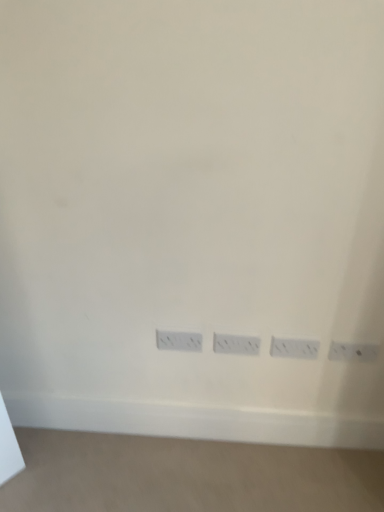
This screenshot has height=512, width=384. What do you see at coordinates (236, 344) in the screenshot?
I see `white plastic power plugs and sockets at center, the second power plugs and sockets when ordered from left to right` at bounding box center [236, 344].

Identify the location of white plastic power plugs and sockets at center, positioned as the third power plugs and sockets in right-to-left order. This screenshot has height=512, width=384. click(x=236, y=344).

The height and width of the screenshot is (512, 384). What are the coordinates of `white plastic power plugs and sockets at center, positioned as the 3th power plugs and sockets in left-to-right order` in the screenshot? It's located at (294, 348).

This screenshot has width=384, height=512. What are the coordinates of `white plastic power plugs and sockets at lower right, the 1th power plugs and sockets from the right` in the screenshot? It's located at (353, 352).

The image size is (384, 512). What do you see at coordinates (353, 352) in the screenshot?
I see `white plastic power plugs and sockets at lower right, placed as the 4th power plugs and sockets when sorted from left to right` at bounding box center [353, 352].

The width and height of the screenshot is (384, 512). What do you see at coordinates (179, 341) in the screenshot? I see `white plastic power plugs and sockets at lower center, which appears as the first power plugs and sockets when viewed from the left` at bounding box center [179, 341].

I want to click on white plastic power plugs and sockets at center, positioned as the third power plugs and sockets in right-to-left order, so click(236, 344).

From the image's perspective, is white plastic power plugs and sockets at lower right, the 1th power plugs and sockets from the right, located above white plastic power plugs and sockets at lower center, which is counted as the 4th power plugs and sockets, starting from the right?

No, from the image's perspective, white plastic power plugs and sockets at lower right, the 1th power plugs and sockets from the right, is not above white plastic power plugs and sockets at lower center, which is counted as the 4th power plugs and sockets, starting from the right.

Is white plastic power plugs and sockets at lower right, placed as the 4th power plugs and sockets when sorted from left to right, oriented away from white plastic power plugs and sockets at lower center, which appears as the first power plugs and sockets when viewed from the left?

white plastic power plugs and sockets at lower right, placed as the 4th power plugs and sockets when sorted from left to right, is not turned away from white plastic power plugs and sockets at lower center, which appears as the first power plugs and sockets when viewed from the left.

In the scene shown: Which object is closer to the camera taking this photo, white plastic power plugs and sockets at lower right, placed as the 4th power plugs and sockets when sorted from left to right, or white plastic power plugs and sockets at lower center, which appears as the first power plugs and sockets when viewed from the left?

white plastic power plugs and sockets at lower right, placed as the 4th power plugs and sockets when sorted from left to right.

Is white plastic power plugs and sockets at lower right, the 1th power plugs and sockets from the right, bigger or smaller than white plastic power plugs and sockets at lower center, which is counted as the 4th power plugs and sockets, starting from the right?

Clearly, white plastic power plugs and sockets at lower right, the 1th power plugs and sockets from the right, is smaller in size than white plastic power plugs and sockets at lower center, which is counted as the 4th power plugs and sockets, starting from the right.

Between point (361, 347) and point (294, 344), which one is positioned behind?

The point (294, 344) is more distant.

Does white plastic power plugs and sockets at lower right, the 1th power plugs and sockets from the right, touch white plastic power plugs and sockets at center, positioned as the 3th power plugs and sockets in left-to-right order?

There is a gap between white plastic power plugs and sockets at lower right, the 1th power plugs and sockets from the right, and white plastic power plugs and sockets at center, positioned as the 3th power plugs and sockets in left-to-right order.

From the image's perspective, is white plastic power plugs and sockets at lower right, placed as the 4th power plugs and sockets when sorted from left to right, on top of white plastic power plugs and sockets at center, positioned as the 3th power plugs and sockets in left-to-right order?

No, from the image's perspective, white plastic power plugs and sockets at lower right, placed as the 4th power plugs and sockets when sorted from left to right, is not on top of white plastic power plugs and sockets at center, positioned as the 3th power plugs and sockets in left-to-right order.

From a real-world perspective, is white plastic power plugs and sockets at lower right, placed as the 4th power plugs and sockets when sorted from left to right, on white plastic power plugs and sockets at center, which is the second power plugs and sockets from right to left?

Correct, in the physical world, white plastic power plugs and sockets at lower right, placed as the 4th power plugs and sockets when sorted from left to right, is higher than white plastic power plugs and sockets at center, which is the second power plugs and sockets from right to left.

Does white plastic power plugs and sockets at lower center, which is counted as the 4th power plugs and sockets, starting from the right, have a greater width compared to white plastic power plugs and sockets at center, the second power plugs and sockets when ordered from left to right?

Indeed, white plastic power plugs and sockets at lower center, which is counted as the 4th power plugs and sockets, starting from the right, has a greater width compared to white plastic power plugs and sockets at center, the second power plugs and sockets when ordered from left to right.

Where is `power plugs and sockets that is above the white plastic power plugs and sockets at center, the second power plugs and sockets when ordered from left to right (from the image's perspective)`? This screenshot has height=512, width=384. power plugs and sockets that is above the white plastic power plugs and sockets at center, the second power plugs and sockets when ordered from left to right (from the image's perspective) is located at coordinates (179, 341).

From the image's perspective, between white plastic power plugs and sockets at lower center, which appears as the first power plugs and sockets when viewed from the left, and white plastic power plugs and sockets at center, positioned as the third power plugs and sockets in right-to-left order, who is located below?

white plastic power plugs and sockets at center, positioned as the third power plugs and sockets in right-to-left order, is shown below in the image.

Which is correct: white plastic power plugs and sockets at lower center, which is counted as the 4th power plugs and sockets, starting from the right, is inside white plastic power plugs and sockets at center, the second power plugs and sockets when ordered from left to right, or outside of it?

white plastic power plugs and sockets at lower center, which is counted as the 4th power plugs and sockets, starting from the right, is located beyond the bounds of white plastic power plugs and sockets at center, the second power plugs and sockets when ordered from left to right.

Which object is wider, white plastic power plugs and sockets at center, positioned as the 3th power plugs and sockets in left-to-right order, or white plastic power plugs and sockets at lower center, which appears as the first power plugs and sockets when viewed from the left?

white plastic power plugs and sockets at lower center, which appears as the first power plugs and sockets when viewed from the left, is wider.

From a real-world perspective, is white plastic power plugs and sockets at center, positioned as the 3th power plugs and sockets in left-to-right order, physically located above or below white plastic power plugs and sockets at lower center, which is counted as the 4th power plugs and sockets, starting from the right?

white plastic power plugs and sockets at center, positioned as the 3th power plugs and sockets in left-to-right order, is below white plastic power plugs and sockets at lower center, which is counted as the 4th power plugs and sockets, starting from the right.

Measure the distance between white plastic power plugs and sockets at center, positioned as the 3th power plugs and sockets in left-to-right order, and white plastic power plugs and sockets at lower center, which appears as the first power plugs and sockets when viewed from the left.

They are 12.05 inches apart.

Considering the points (309, 358) and (178, 339), which point is behind, point (309, 358) or point (178, 339)?

Point (309, 358)

In the scene shown: Could you tell me if white plastic power plugs and sockets at center, the second power plugs and sockets when ordered from left to right, is facing white plastic power plugs and sockets at lower center, which is counted as the 4th power plugs and sockets, starting from the right?

No, white plastic power plugs and sockets at center, the second power plugs and sockets when ordered from left to right, is not turned towards white plastic power plugs and sockets at lower center, which is counted as the 4th power plugs and sockets, starting from the right.

Is white plastic power plugs and sockets at center, the second power plugs and sockets when ordered from left to right, at the left side of white plastic power plugs and sockets at lower center, which appears as the first power plugs and sockets when viewed from the left?

No.

From the image's perspective, is white plastic power plugs and sockets at center, positioned as the third power plugs and sockets in right-to-left order, positioned above or below white plastic power plugs and sockets at lower center, which appears as the first power plugs and sockets when viewed from the left?

Based on their image positions, white plastic power plugs and sockets at center, positioned as the third power plugs and sockets in right-to-left order, is located beneath white plastic power plugs and sockets at lower center, which appears as the first power plugs and sockets when viewed from the left.

Can you tell me how much white plastic power plugs and sockets at center, the second power plugs and sockets when ordered from left to right, and white plastic power plugs and sockets at lower center, which is counted as the 4th power plugs and sockets, starting from the right, differ in facing direction?

The facing directions of white plastic power plugs and sockets at center, the second power plugs and sockets when ordered from left to right, and white plastic power plugs and sockets at lower center, which is counted as the 4th power plugs and sockets, starting from the right, are 0.0612 degrees apart.

Is white plastic power plugs and sockets at lower center, which appears as the first power plugs and sockets when viewed from the left, shorter than white plastic power plugs and sockets at center, which is the second power plugs and sockets from right to left?

Yes.

From the image's perspective, would you say white plastic power plugs and sockets at lower center, which is counted as the 4th power plugs and sockets, starting from the right, is shown under white plastic power plugs and sockets at center, which is the second power plugs and sockets from right to left?

Actually, white plastic power plugs and sockets at lower center, which is counted as the 4th power plugs and sockets, starting from the right, appears above white plastic power plugs and sockets at center, which is the second power plugs and sockets from right to left, in the image.

From a real-world perspective, who is located lower, white plastic power plugs and sockets at lower center, which appears as the first power plugs and sockets when viewed from the left, or white plastic power plugs and sockets at center, positioned as the 3th power plugs and sockets in left-to-right order?

From a 3D spatial view, white plastic power plugs and sockets at center, positioned as the 3th power plugs and sockets in left-to-right order, is below.

Considering the relative sizes of white plastic power plugs and sockets at lower center, which appears as the first power plugs and sockets when viewed from the left, and white plastic power plugs and sockets at center, which is the second power plugs and sockets from right to left, in the image provided, is white plastic power plugs and sockets at lower center, which appears as the first power plugs and sockets when viewed from the left, thinner than white plastic power plugs and sockets at center, which is the second power plugs and sockets from right to left,?

No, white plastic power plugs and sockets at lower center, which appears as the first power plugs and sockets when viewed from the left, is not thinner than white plastic power plugs and sockets at center, which is the second power plugs and sockets from right to left.

Between white plastic power plugs and sockets at center, positioned as the 3th power plugs and sockets in left-to-right order, and white plastic power plugs and sockets at lower right, the 1th power plugs and sockets from the right, which one is positioned behind?

white plastic power plugs and sockets at center, positioned as the 3th power plugs and sockets in left-to-right order, is further away from the camera.

From a real-world perspective, count 2nd power plugs and socketss downward from the white plastic power plugs and sockets at lower right, placed as the 4th power plugs and sockets when sorted from left to right, and point to it. Please provide its 2D coordinates.

[(294, 348)]

Which is more to the left, white plastic power plugs and sockets at center, which is the second power plugs and sockets from right to left, or white plastic power plugs and sockets at lower right, the 1th power plugs and sockets from the right?

Positioned to the left is white plastic power plugs and sockets at center, which is the second power plugs and sockets from right to left.

Where is `power plugs and sockets that is the 1st object directly below the white plastic power plugs and sockets at lower right, the 1th power plugs and sockets from the right (from a real-world perspective)`? The height and width of the screenshot is (512, 384). power plugs and sockets that is the 1st object directly below the white plastic power plugs and sockets at lower right, the 1th power plugs and sockets from the right (from a real-world perspective) is located at coordinates (179, 341).

In the image, there is a white plastic power plugs and sockets at center, which is the second power plugs and sockets from right to left. Where is `power plugs and sockets below it (from the image's perspective)`? power plugs and sockets below it (from the image's perspective) is located at coordinates (353, 352).

Looking at the image, which one is located further to white plastic power plugs and sockets at center, the second power plugs and sockets when ordered from left to right, white plastic power plugs and sockets at lower center, which appears as the first power plugs and sockets when viewed from the left, or white plastic power plugs and sockets at center, positioned as the 3th power plugs and sockets in left-to-right order?

The object further to white plastic power plugs and sockets at center, the second power plugs and sockets when ordered from left to right, is white plastic power plugs and sockets at lower center, which appears as the first power plugs and sockets when viewed from the left.

Looking at the image, which one is located further to white plastic power plugs and sockets at lower center, which is counted as the 4th power plugs and sockets, starting from the right, white plastic power plugs and sockets at center, the second power plugs and sockets when ordered from left to right, or white plastic power plugs and sockets at lower right, the 1th power plugs and sockets from the right?

Among the two, white plastic power plugs and sockets at lower right, the 1th power plugs and sockets from the right, is located further to white plastic power plugs and sockets at lower center, which is counted as the 4th power plugs and sockets, starting from the right.

Which object lies nearer to the anchor point white plastic power plugs and sockets at lower right, the 1th power plugs and sockets from the right, white plastic power plugs and sockets at center, positioned as the 3th power plugs and sockets in left-to-right order, or white plastic power plugs and sockets at center, the second power plugs and sockets when ordered from left to right?

Based on the image, white plastic power plugs and sockets at center, positioned as the 3th power plugs and sockets in left-to-right order, appears to be nearer to white plastic power plugs and sockets at lower right, the 1th power plugs and sockets from the right.

Which object lies further to the anchor point white plastic power plugs and sockets at lower center, which appears as the first power plugs and sockets when viewed from the left, white plastic power plugs and sockets at center, the second power plugs and sockets when ordered from left to right, or white plastic power plugs and sockets at center, positioned as the 3th power plugs and sockets in left-to-right order?

Among the two, white plastic power plugs and sockets at center, positioned as the 3th power plugs and sockets in left-to-right order, is located further to white plastic power plugs and sockets at lower center, which appears as the first power plugs and sockets when viewed from the left.

Consider the image. Based on their spatial positions, is white plastic power plugs and sockets at lower right, placed as the 4th power plugs and sockets when sorted from left to right, or white plastic power plugs and sockets at center, positioned as the 3th power plugs and sockets in left-to-right order, closer to white plastic power plugs and sockets at lower center, which is counted as the 4th power plugs and sockets, starting from the right?

white plastic power plugs and sockets at center, positioned as the 3th power plugs and sockets in left-to-right order, is positioned closer to the anchor white plastic power plugs and sockets at lower center, which is counted as the 4th power plugs and sockets, starting from the right.

From the image, which object appears to be farther from white plastic power plugs and sockets at lower center, which appears as the first power plugs and sockets when viewed from the left, white plastic power plugs and sockets at lower right, the 1th power plugs and sockets from the right, or white plastic power plugs and sockets at center, the second power plugs and sockets when ordered from left to right?

white plastic power plugs and sockets at lower right, the 1th power plugs and sockets from the right, lies further to white plastic power plugs and sockets at lower center, which appears as the first power plugs and sockets when viewed from the left, than the other object.

When comparing their distances from white plastic power plugs and sockets at lower center, which appears as the first power plugs and sockets when viewed from the left, does white plastic power plugs and sockets at center, which is the second power plugs and sockets from right to left, or white plastic power plugs and sockets at center, positioned as the third power plugs and sockets in right-to-left order, seem closer?

white plastic power plugs and sockets at center, positioned as the third power plugs and sockets in right-to-left order.

Estimate the real-world distances between objects in this image. Which object is closer to white plastic power plugs and sockets at center, the second power plugs and sockets when ordered from left to right, white plastic power plugs and sockets at center, positioned as the 3th power plugs and sockets in left-to-right order, or white plastic power plugs and sockets at lower center, which appears as the first power plugs and sockets when viewed from the left?

The object closer to white plastic power plugs and sockets at center, the second power plugs and sockets when ordered from left to right, is white plastic power plugs and sockets at center, positioned as the 3th power plugs and sockets in left-to-right order.

Identify the location of power plugs and sockets situated between white plastic power plugs and sockets at lower center, which appears as the first power plugs and sockets when viewed from the left, and white plastic power plugs and sockets at center, which is the second power plugs and sockets from right to left, from left to right. (236, 344).

In order to click on power plugs and sockets between white plastic power plugs and sockets at center, the second power plugs and sockets when ordered from left to right, and white plastic power plugs and sockets at lower right, the 1th power plugs and sockets from the right, from left to right in this screenshot , I will do `click(294, 348)`.